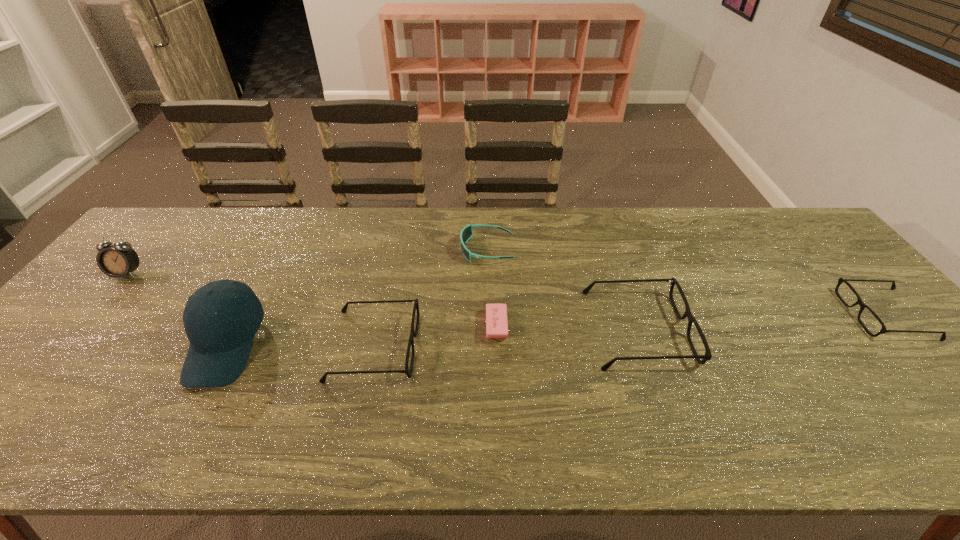
In order to click on vacant space located 0.280m on the right of the eraser in this screenshot , I will do `click(615, 326)`.

Locate an element on the screen. object located at the far edge is located at coordinates (466, 233).

Where is `spectacles that is at the near edge`? The image size is (960, 540). spectacles that is at the near edge is located at coordinates (413, 333).

This screenshot has height=540, width=960. Identify the location of baseball cap located in the near edge section of the desktop. (220, 344).

You are a GUI agent. You are given a task and a screenshot of the screen. Output one action in this format:
    pyautogui.click(x=<x>, y=<y>)
    Task: Click on the object positioned at the left edge
    
    Given the screenshot: What is the action you would take?
    pyautogui.click(x=118, y=260)

This screenshot has height=540, width=960. In order to click on object situated at the right edge in this screenshot , I will do `click(883, 330)`.

Find the location of a particular element. blank space at the far edge of the desktop is located at coordinates (287, 241).

This screenshot has height=540, width=960. I want to click on free space at the near edge of the desktop, so click(x=189, y=406).

The image size is (960, 540). In the image, there is a desktop. Find the location of `vacant space at the right edge`. vacant space at the right edge is located at coordinates (874, 364).

Locate an element on the screen. The width and height of the screenshot is (960, 540). free space between the second object from left to right and the rightmost object is located at coordinates (555, 330).